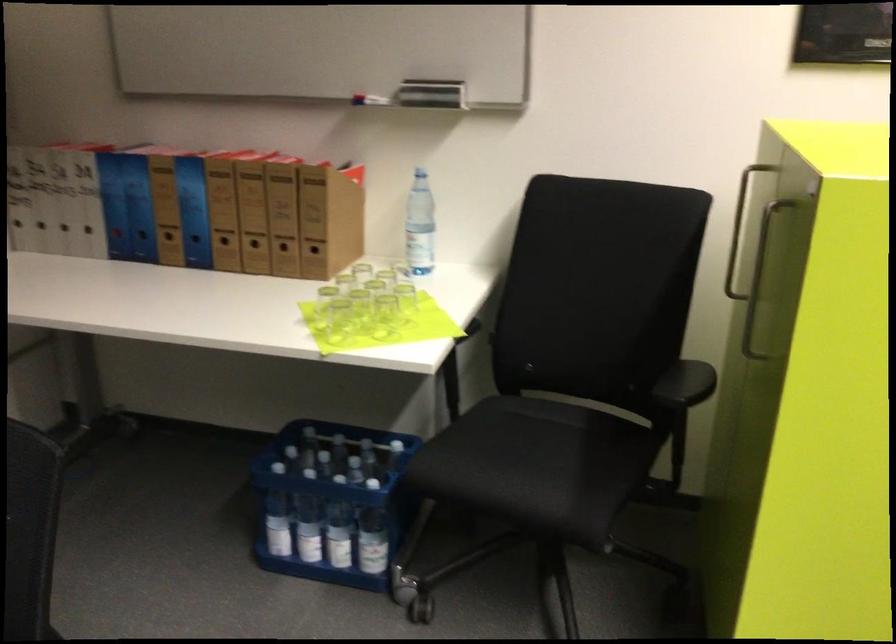
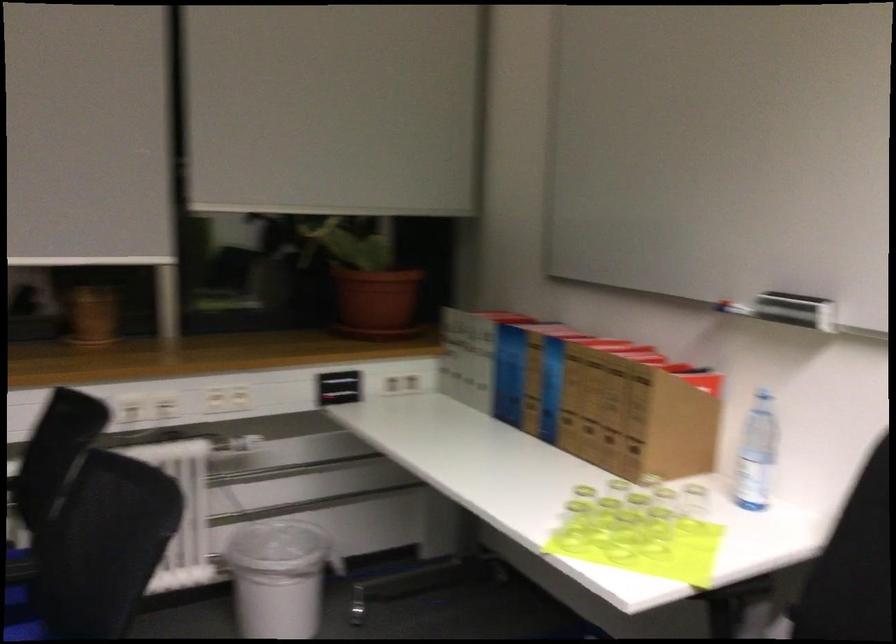
Where in the second image is the point corresponding to (410,228) from the first image?

(755, 453)